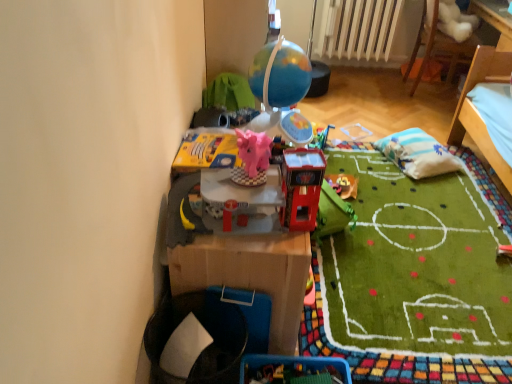
Question: Is striped fabric pillow at center right bigger or smaller than shiny plastic toy at center, placed as the 1th toy when sorted from back to front?

Choices:
 (A) big
 (B) small

Answer: (A)

Question: Do you think striped fabric pillow at center right is within shiny plastic toy at center, arranged as the third toy when viewed from the front, or outside of it?

Choices:
 (A) inside
 (B) outside

Answer: (B)

Question: Considering the real-world distances, which object is closest to the striped fabric pillow at center right?

Choices:
 (A) white plastic radiator at upper center
 (B) white plush toy at upper right
 (C) shiny plastic toy at center, the second toy positioned from the right
 (D) matte pink elephant at center, the first toy viewed from the left
 (E) shiny plastic toy at center, arranged as the third toy when viewed from the front

Answer: (E)

Question: Considering the real-world distances, which object is farthest from the matte pink elephant at center, arranged as the 3th toy when viewed from the right?

Choices:
 (A) striped fabric pillow at center right
 (B) white plush toy at upper right
 (C) shiny plastic toy at center, the 3th toy positioned from the back
 (D) shiny plastic toy at center, arranged as the third toy when viewed from the front
 (E) white plastic radiator at upper center

Answer: (E)